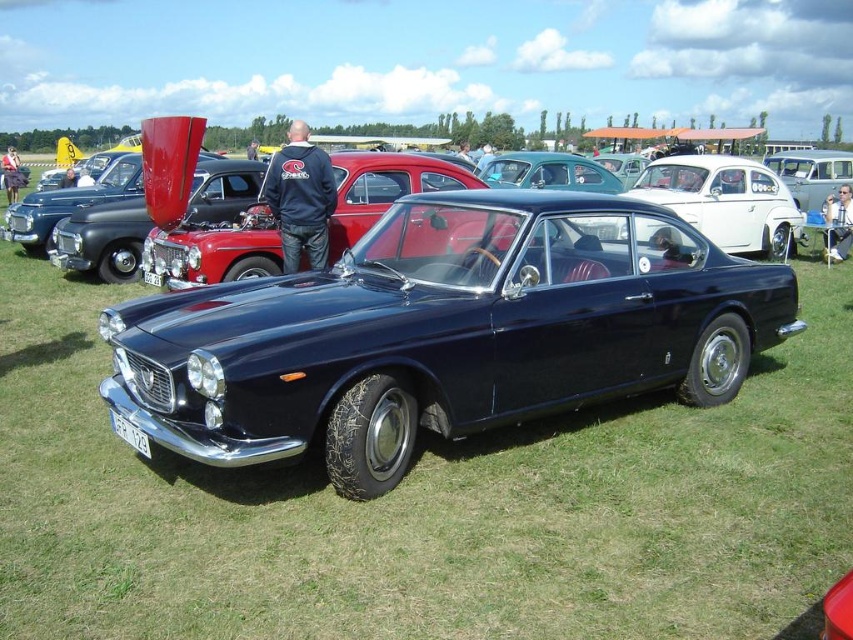
Question: Can you confirm if shiny dark blue sedan at center is thinner than dark blue leather jacket at center?

Choices:
 (A) no
 (B) yes

Answer: (B)

Question: Is shiny dark blue car at center below black plastic license plate at center?

Choices:
 (A) yes
 (B) no

Answer: (B)

Question: Which object is farther from the camera taking this photo?

Choices:
 (A) shiny dark blue sedan at center
 (B) black plastic license plate at center

Answer: (A)

Question: Is shiny dark blue sedan at center to the right of black fabric jacket at center from the viewer's perspective?

Choices:
 (A) yes
 (B) no

Answer: (B)

Question: Which is farther from the dark blue leather jacket at center?

Choices:
 (A) black plastic license plate at center
 (B) shiny dark blue car at center

Answer: (A)

Question: Estimate the real-world distances between objects in this image. Which object is farther from the shiny dark blue sedan at center?

Choices:
 (A) shiny dark blue car at center
 (B) white plastic license plate at center
 (C) white glossy sedan at center

Answer: (C)